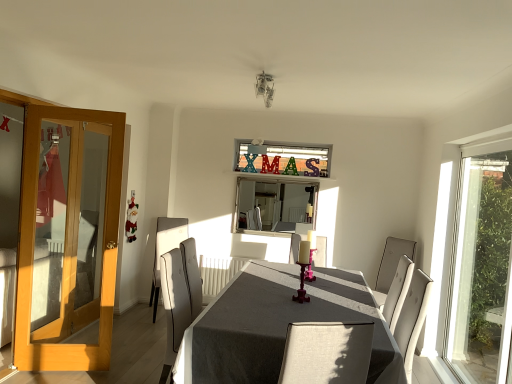
Question: Can you confirm if silver metallic mirror at center is thinner than gray fabric table at center?

Choices:
 (A) no
 (B) yes

Answer: (B)

Question: Can you confirm if silver metallic mirror at center is wider than gray fabric table at center?

Choices:
 (A) no
 (B) yes

Answer: (A)

Question: Are silver metallic mirror at center and gray fabric table at center beside each other?

Choices:
 (A) yes
 (B) no

Answer: (B)

Question: From the image's perspective, is silver metallic mirror at center under gray fabric table at center?

Choices:
 (A) yes
 (B) no

Answer: (B)

Question: Can you confirm if silver metallic mirror at center is taller than gray fabric table at center?

Choices:
 (A) yes
 (B) no

Answer: (B)

Question: Can you confirm if silver metallic mirror at center is shorter than gray fabric table at center?

Choices:
 (A) no
 (B) yes

Answer: (B)

Question: From a real-world perspective, is gray fabric table at center below pink glossy candle holder at center?

Choices:
 (A) no
 (B) yes

Answer: (B)

Question: Considering the relative sizes of gray fabric table at center and pink glossy candle holder at center in the image provided, is gray fabric table at center thinner than pink glossy candle holder at center?

Choices:
 (A) no
 (B) yes

Answer: (A)

Question: Is gray fabric table at center oriented away from pink glossy candle holder at center?

Choices:
 (A) yes
 (B) no

Answer: (B)

Question: Is gray fabric table at center behind pink glossy candle holder at center?

Choices:
 (A) no
 (B) yes

Answer: (A)

Question: Is gray fabric table at center smaller than pink glossy candle holder at center?

Choices:
 (A) no
 (B) yes

Answer: (A)

Question: Considering the relative sizes of gray fabric table at center and pink glossy candle holder at center in the image provided, is gray fabric table at center taller than pink glossy candle holder at center?

Choices:
 (A) yes
 (B) no

Answer: (A)

Question: From a real-world perspective, is light brown wooden door at left over light gray fabric chair at center, the second chair in the right-to-left sequence?

Choices:
 (A) no
 (B) yes

Answer: (B)